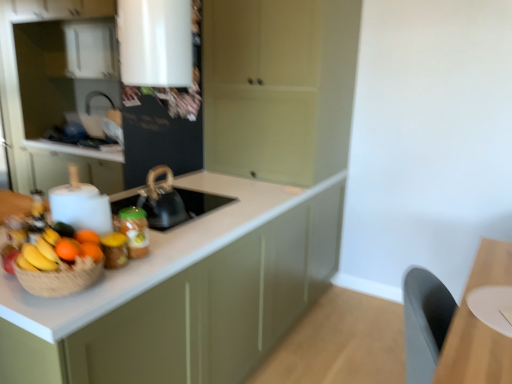
Image resolution: width=512 pixels, height=384 pixels. Identify the location of vacant area that lies to the right of orange matte at left, the 2th orange when ordered from front to back. (121, 274).